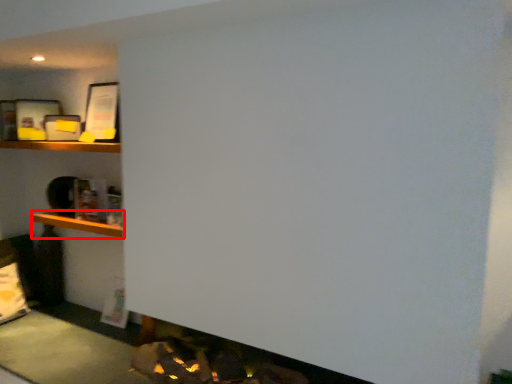
Question: From the image's perspective, what is the correct spatial relationship of cabinet (annotated by the red box) in relation to shelf?

Choices:
 (A) below
 (B) above

Answer: (A)